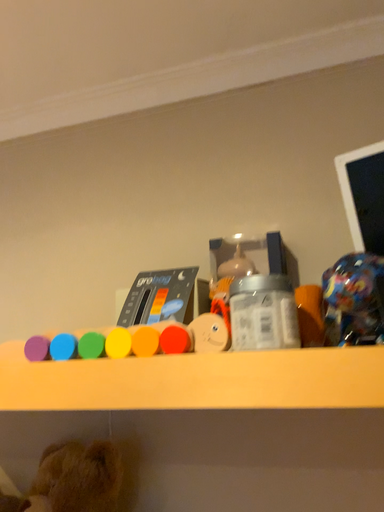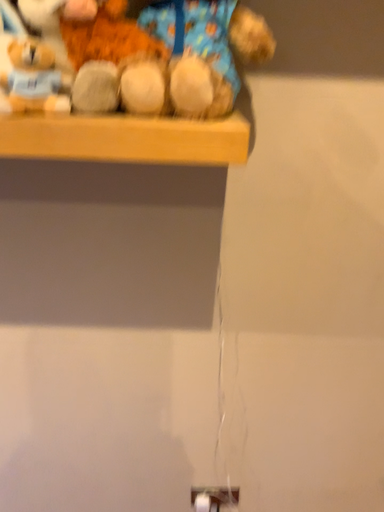
Question: How did the camera likely rotate when shooting the video?

Choices:
 (A) rotated right
 (B) rotated left

Answer: (A)